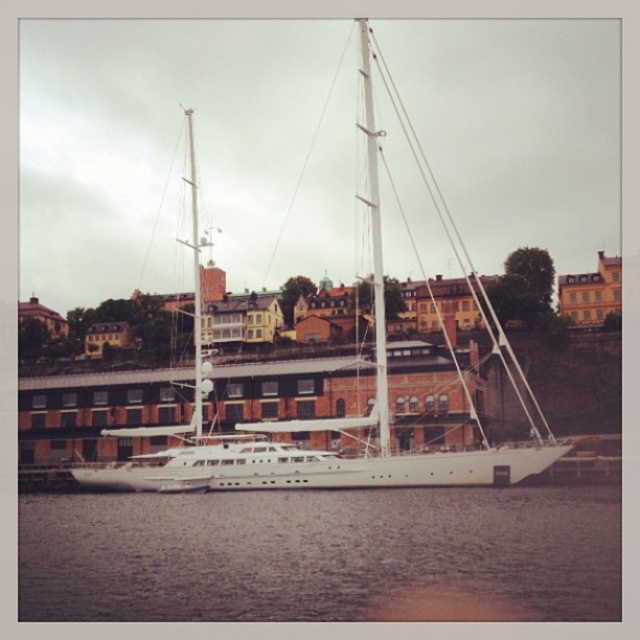
The image size is (640, 640). Describe the element at coordinates (314, 552) in the screenshot. I see `clear water at lower center` at that location.

Who is shorter, clear water at lower center or white glossy sailboat at center?

Standing shorter between the two is clear water at lower center.

Between point (582, 538) and point (193, 148), which one is positioned behind?

The point (193, 148) is behind.

You are a GUI agent. You are given a task and a screenshot of the screen. Output one action in this format:
    pyautogui.click(x=<x>, y=<y>)
    Task: Click on the clear water at lower center
    
    Given the screenshot: What is the action you would take?
    pyautogui.click(x=314, y=552)